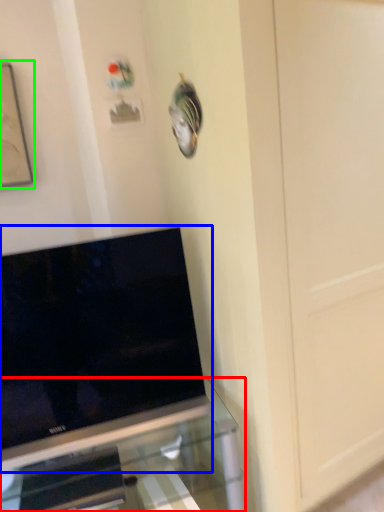
Question: Based on their relative distances, which object is farther from furniture (highlighted by a red box)? Choose from television (highlighted by a blue box) and picture frame (highlighted by a green box).

Choices:
 (A) television
 (B) picture frame

Answer: (B)